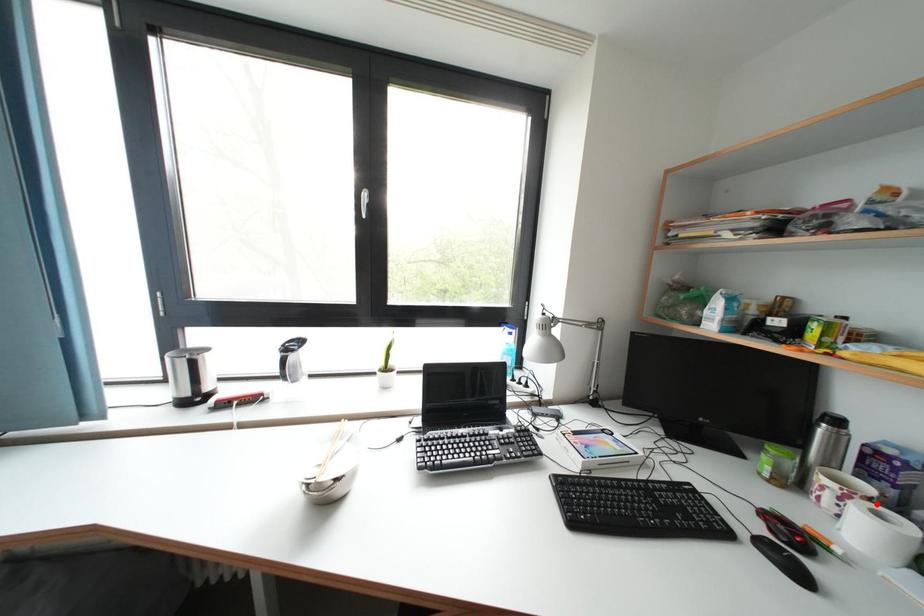
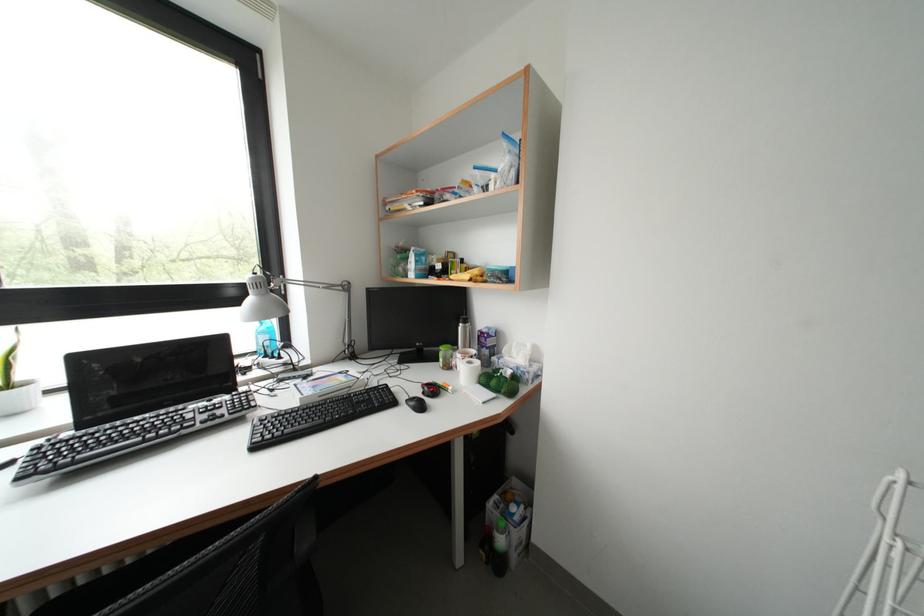
The point at the highlighted location is marked in the first image. Where is the corresponding point in the second image?

(479, 362)